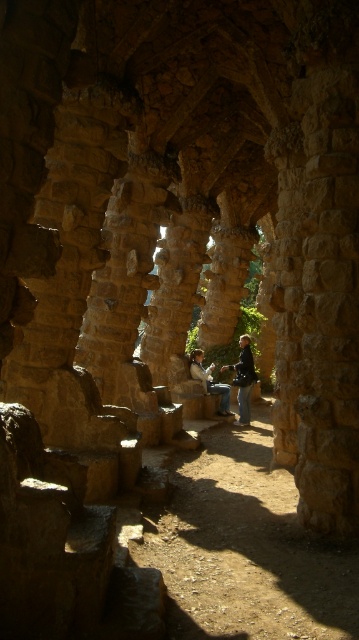
Question: Can you confirm if dark gray fabric jacket at center is smaller than matte brown hair at center?

Choices:
 (A) yes
 (B) no

Answer: (A)

Question: Which object appears farthest from the camera in this image?

Choices:
 (A) dark gray fabric jacket at center
 (B) matte brown hair at center

Answer: (A)

Question: Can you confirm if dark gray fabric jacket at center is bigger than matte brown hair at center?

Choices:
 (A) no
 (B) yes

Answer: (A)

Question: Which of the following is the closest to the observer?

Choices:
 (A) matte brown hair at center
 (B) dark gray fabric jacket at center

Answer: (A)

Question: Can you confirm if dark gray fabric jacket at center is smaller than matte brown hair at center?

Choices:
 (A) no
 (B) yes

Answer: (B)

Question: Which point appears closest to the camera in this image?

Choices:
 (A) tap(226, 392)
 (B) tap(240, 416)

Answer: (B)